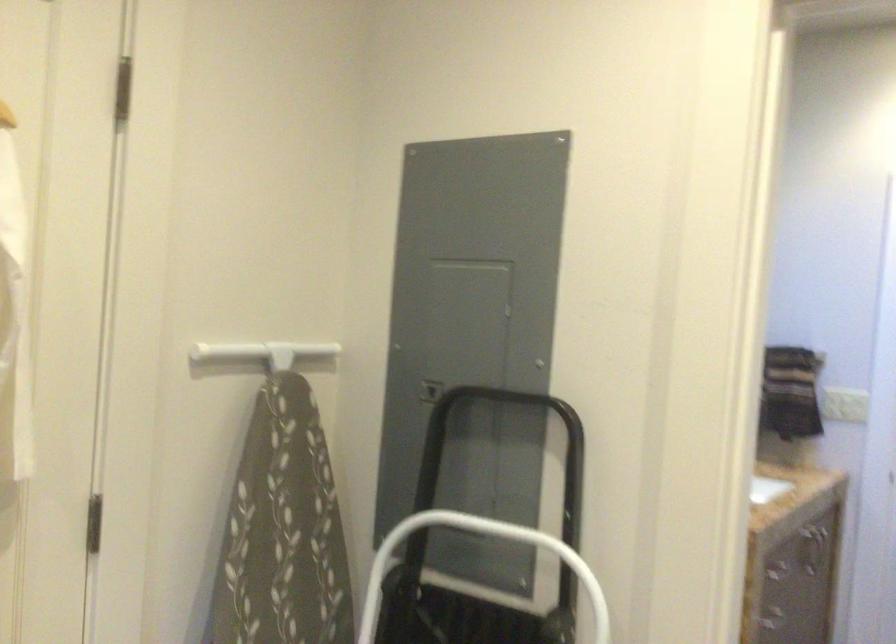
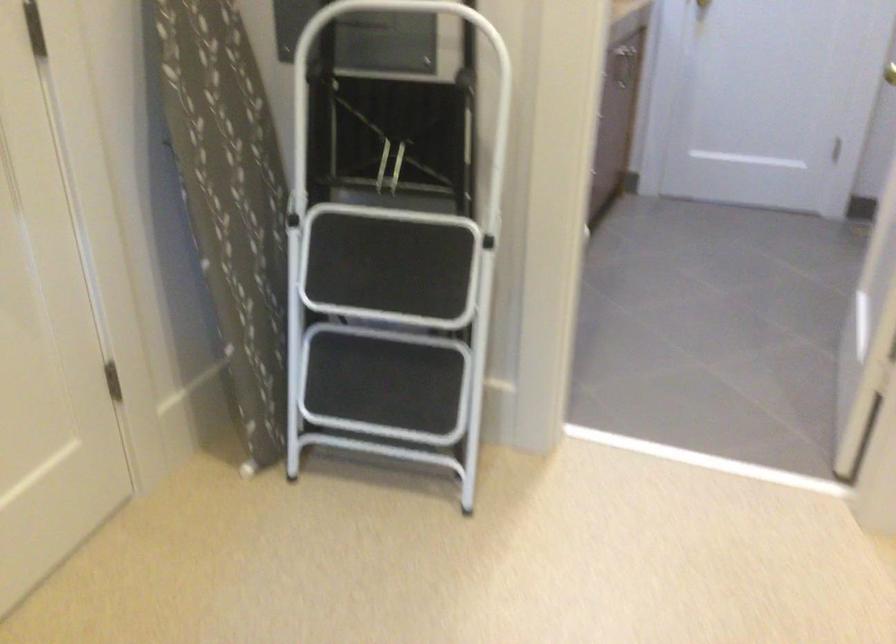
Question: The images are taken continuously from a first-person perspective. In which direction is your viewpoint rotating?

Choices:
 (A) Left
 (B) Right
 (C) Up
 (D) Down

Answer: (D)